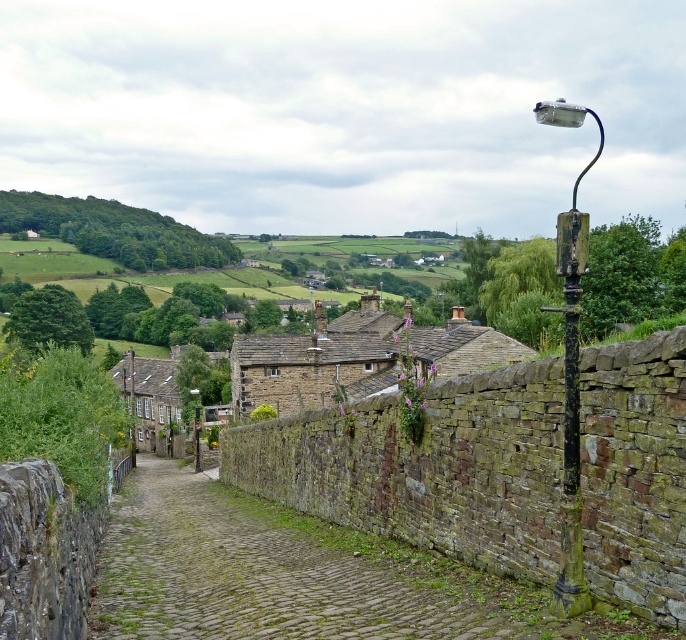
You are standing at the starting point of the cobblestone path in the image. You want to walk towards the brown stone houses at center. Which direction should you walk relative to the path?

The brown stone houses at center are positioned at point (314, 364), so you should walk uphill along the cobblestone path towards them.

You are a tourist standing at the start of the cobblestone path and want to take a photo of the rusty metal streetlamp at right without the brown stone houses at center blocking it. Is this possible from your current position?

The rusty metal streetlamp at right is behind the brown stone houses at center, so you cannot take a photo of the rusty metal streetlamp at right without the brown stone houses at center blocking it from your current position.

From the picture: You are a delivery person trying to navigate through the narrow cobblestone path bordered by the brown stone houses at center and the rusty metal streetlamp at right. Based on their widths, which structure would allow more space for your delivery van to pass safely?

The rusty metal streetlamp at right allows more space for the delivery van to pass safely because the brown stone houses at center has a lesser width compared to rusty metal streetlamp at right.